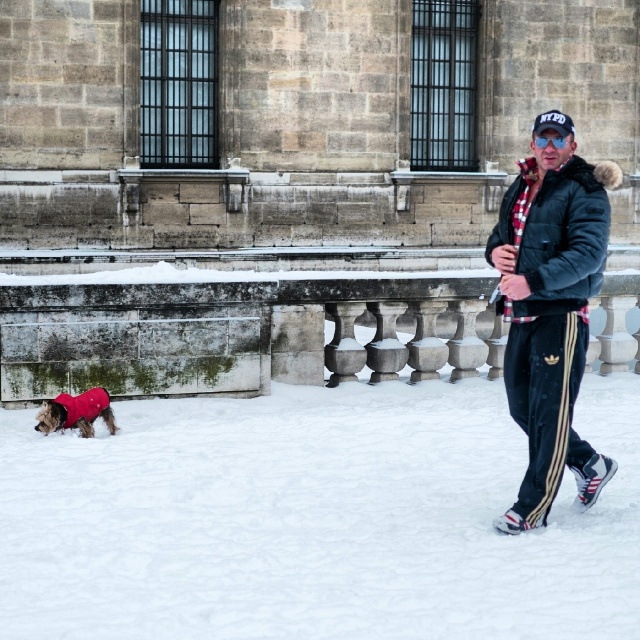
Is black matte jacket at right bigger than red fleece coat at lower left?

Actually, black matte jacket at right might be smaller than red fleece coat at lower left.

This screenshot has height=640, width=640. What do you see at coordinates (550, 312) in the screenshot? I see `black matte jacket at right` at bounding box center [550, 312].

In order to click on black matte jacket at right in this screenshot , I will do `click(550, 312)`.

Is point (529, 269) farther from viewer compared to point (547, 244)?

No.

Who is positioned more to the right, black matte jacket at right or plaid woolen jacket at center?

plaid woolen jacket at center

The height and width of the screenshot is (640, 640). Find the location of `black matte jacket at right`. black matte jacket at right is located at coordinates (550, 312).

Does white fluffy snow at lower left lie behind red fleece coat at lower left?

No, it is in front of red fleece coat at lower left.

Can you confirm if white fluffy snow at lower left is positioned below red fleece coat at lower left?

Yes.

Locate an element on the screen. This screenshot has height=640, width=640. white fluffy snow at lower left is located at coordinates (314, 518).